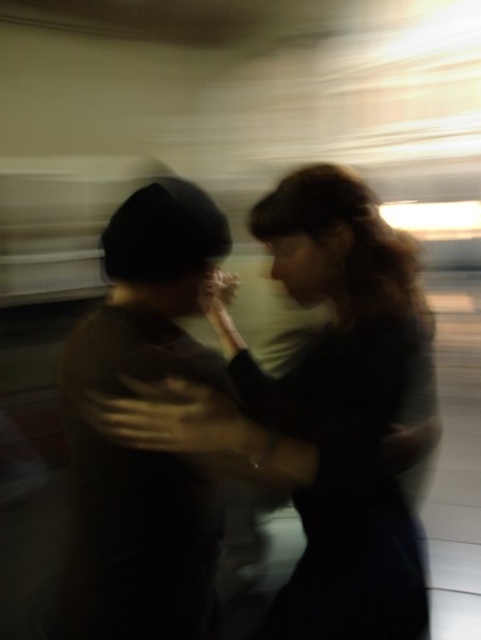
Question: Does dark brown fabric at center appear on the right side of dark brown knit hat at left?

Choices:
 (A) no
 (B) yes

Answer: (B)

Question: Can you confirm if dark brown fabric at center is positioned to the left of dark brown knit hat at left?

Choices:
 (A) no
 (B) yes

Answer: (A)

Question: Which point appears farthest from the camera in this image?

Choices:
 (A) (85, 444)
 (B) (390, 605)

Answer: (B)

Question: Which point appears farthest from the camera in this image?

Choices:
 (A) (122, 458)
 (B) (331, 188)

Answer: (B)

Question: Is dark brown fabric at center further to camera compared to dark brown knit hat at left?

Choices:
 (A) no
 (B) yes

Answer: (A)